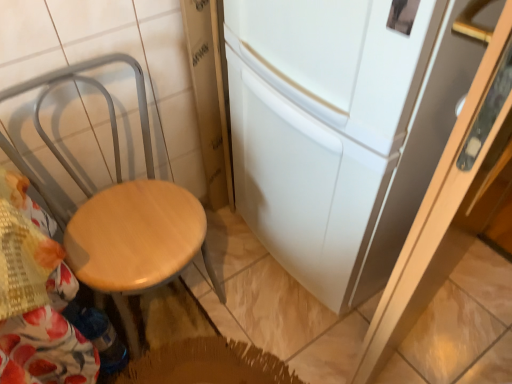
Where is `free region under wooden seat at left (from a real-world perspective)`? free region under wooden seat at left (from a real-world perspective) is located at coordinates (173, 314).